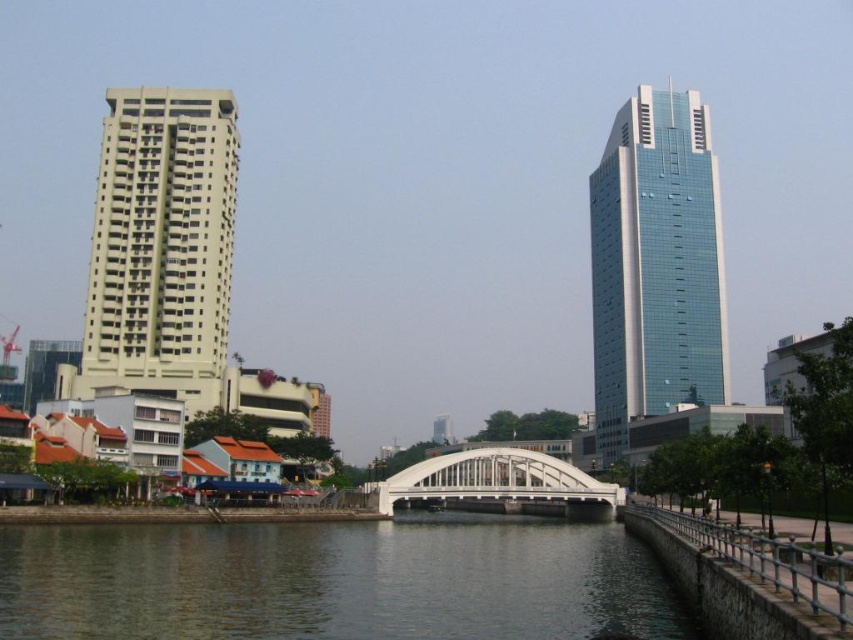
You are a drone operator trying to fly a drone from the blue glass skyscraper at right to the white metallic bridge at center. Based on the scene, can you safely navigate the drone between them without any obstacles?

The blue glass skyscraper at right is above the white metallic bridge at center, so the drone can safely navigate between them as there is no obstruction in between.

You are standing on the stone embankment with the metal railing on the right side of the river. You want to walk to the beige concrete building at left. Which direction should you head towards?

The beige concrete building at left is located at point [161,244], so you should head towards the left side of the river to reach it.